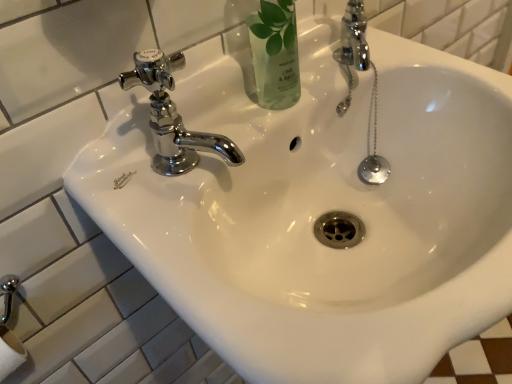
Question: Is chrome/metallic faucet at upper left positioned before clear glass bottle at upper center?

Choices:
 (A) yes
 (B) no

Answer: (A)

Question: Considering the relative sizes of chrome/metallic faucet at upper left and clear glass bottle at upper center in the image provided, is chrome/metallic faucet at upper left shorter than clear glass bottle at upper center?

Choices:
 (A) yes
 (B) no

Answer: (A)

Question: Is chrome/metallic faucet at upper left bigger than clear glass bottle at upper center?

Choices:
 (A) no
 (B) yes

Answer: (A)

Question: From a real-world perspective, is chrome/metallic faucet at upper left beneath clear glass bottle at upper center?

Choices:
 (A) yes
 (B) no

Answer: (A)

Question: Can you confirm if chrome/metallic faucet at upper left is positioned to the right of clear glass bottle at upper center?

Choices:
 (A) no
 (B) yes

Answer: (A)

Question: Is chrome/metallic faucet at upper left behind clear glass bottle at upper center?

Choices:
 (A) no
 (B) yes

Answer: (A)

Question: Is clear glass bottle at upper center oriented away from chrome/metallic faucet at upper left?

Choices:
 (A) no
 (B) yes

Answer: (A)

Question: From the image's perspective, is clear glass bottle at upper center located beneath chrome/metallic faucet at upper left?

Choices:
 (A) yes
 (B) no

Answer: (B)

Question: Does clear glass bottle at upper center come behind chrome/metallic faucet at upper left?

Choices:
 (A) no
 (B) yes

Answer: (B)

Question: Can you confirm if clear glass bottle at upper center is taller than chrome/metallic faucet at upper left?

Choices:
 (A) no
 (B) yes

Answer: (B)

Question: Is clear glass bottle at upper center with chrome/metallic faucet at upper left?

Choices:
 (A) yes
 (B) no

Answer: (B)

Question: From a real-world perspective, is clear glass bottle at upper center located beneath chrome/metallic faucet at upper left?

Choices:
 (A) yes
 (B) no

Answer: (B)

Question: Is clear glass bottle at upper center inside the boundaries of chrome/metallic faucet at upper left, or outside?

Choices:
 (A) inside
 (B) outside

Answer: (B)